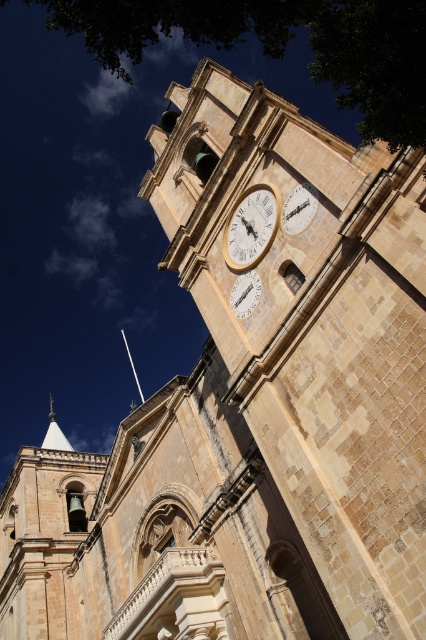
You are an architect inspecting the church facade. You notice two clocks on the tower. Which clock, the white matte clock at upper center or the white glossy clock at center, is located higher up on the tower?

The white matte clock at upper center is located higher up on the tower as it is positioned over the white glossy clock at center.

You are an architect analyzing the church facade. You notice two clocks on the tower. The first is the matte white clock at center, and the second is the white matte clock at upper center. Which of these two clocks is taller?

The matte white clock at center is taller than the white matte clock at upper center.

You are standing at the base of the church tower and want to estimate how far the white matte clock at upper center is from you. Based on the image, what is the approximate distance in meters?

The white matte clock at upper center is approximately 44.30 meters away from the camera.